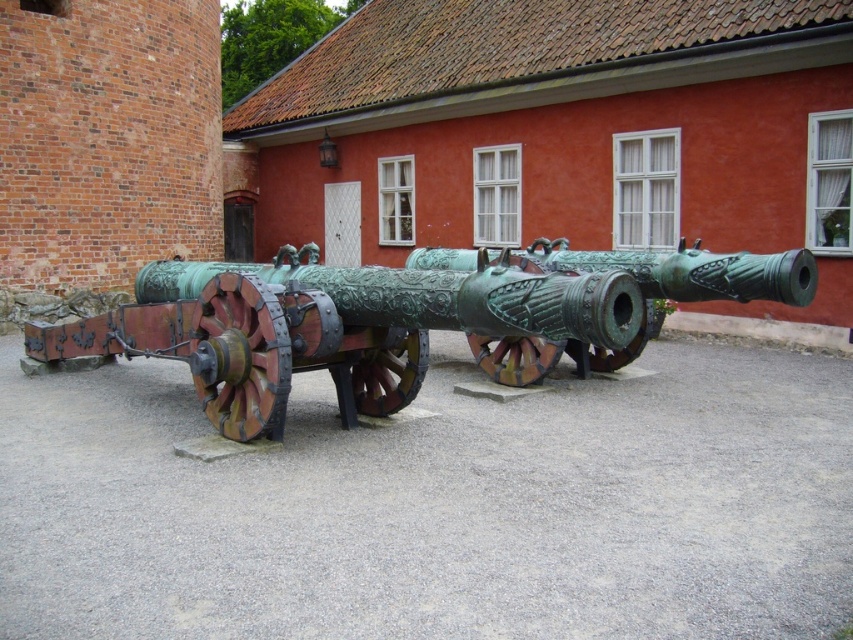
Question: Does green patina metal cannon at center have a larger size compared to bronze/greenish metal cannon at center?

Choices:
 (A) yes
 (B) no

Answer: (B)

Question: Which point is closer to the camera taking this photo?

Choices:
 (A) (697, 256)
 (B) (601, 358)

Answer: (A)

Question: Which of the following is the closest to the observer?

Choices:
 (A) (521, 250)
 (B) (633, 342)

Answer: (B)

Question: Is green patina metal cannon at center smaller than bronze/greenish metal cannon at center?

Choices:
 (A) no
 (B) yes

Answer: (B)

Question: Can you confirm if green patina metal cannon at center is positioned to the right of bronze/greenish metal cannon at center?

Choices:
 (A) yes
 (B) no

Answer: (B)